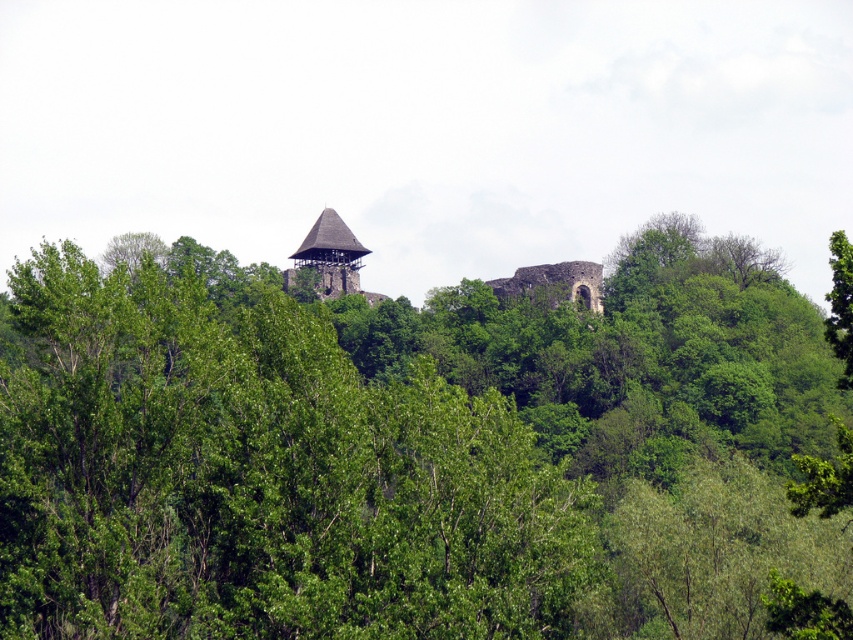
Can you confirm if green leafy tree at upper center is thinner than green leafy tree at upper right?

In fact, green leafy tree at upper center might be wider than green leafy tree at upper right.

Who is shorter, green leafy tree at upper center or green leafy tree at upper right?

green leafy tree at upper right is shorter.

Is point (16, 339) closer to viewer compared to point (842, 356)?

No, (16, 339) is behind (842, 356).

The image size is (853, 640). What are the coordinates of `green leafy tree at upper center` in the screenshot? It's located at 416,451.

Is brown wooden tower at center positioned in front of green leafy tree at upper right?

No, it is behind green leafy tree at upper right.

Does brown wooden tower at center appear on the right side of green leafy tree at upper right?

Incorrect, brown wooden tower at center is not on the right side of green leafy tree at upper right.

Between point (344, 259) and point (849, 307), which one is positioned in front?

Positioned in front is point (849, 307).

The image size is (853, 640). Identify the location of brown wooden tower at center. (331, 259).

Does green leafy tree at upper center have a larger size compared to brown wooden tower at center?

Yes, green leafy tree at upper center is bigger than brown wooden tower at center.

Who is shorter, green leafy tree at upper center or brown wooden tower at center?

brown wooden tower at center is shorter.

Is point (318, 481) positioned before point (316, 257)?

Yes, it is in front of point (316, 257).

Where is `green leafy tree at upper center`? This screenshot has width=853, height=640. green leafy tree at upper center is located at coordinates (416, 451).